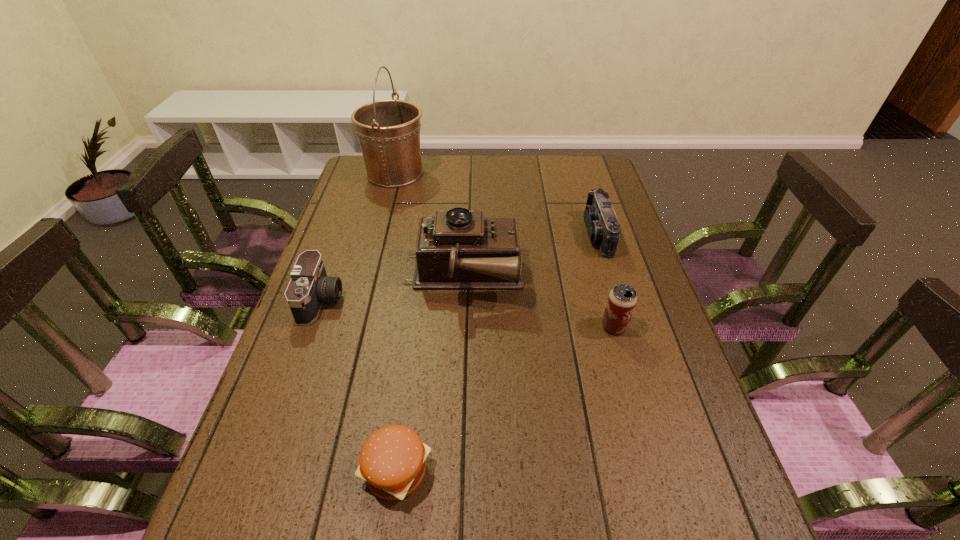
Where is `camcorder that is at the right edge`? The image size is (960, 540). camcorder that is at the right edge is located at coordinates (601, 222).

This screenshot has width=960, height=540. Find the location of `object located in the far left corner section of the desktop`. object located in the far left corner section of the desktop is located at coordinates (388, 131).

Identify the location of vacant point at the far edge. (491, 168).

What are the coordinates of `blank area at the left edge` in the screenshot? It's located at (311, 368).

In the image, there is a desktop. Find the location of `vacant area at the right edge`. vacant area at the right edge is located at coordinates (661, 353).

The height and width of the screenshot is (540, 960). What are the coordinates of `free space at the far left corner of the desktop` in the screenshot? It's located at (362, 161).

Find the location of a particular element. vacant area at the far right corner of the desktop is located at coordinates (600, 183).

Identify the location of free area in between the beer can and the camera. This screenshot has height=540, width=960. (468, 313).

Find the location of a particular element. The height and width of the screenshot is (540, 960). vacant point located between the nearest object and the camera is located at coordinates (359, 386).

Where is `vacant region between the camera and the fifth shortest object`? The height and width of the screenshot is (540, 960). vacant region between the camera and the fifth shortest object is located at coordinates (393, 288).